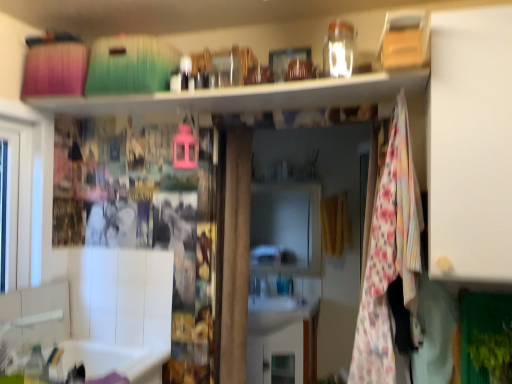
Find the location of a particular element. floral fabric blanket at center-right is located at coordinates (389, 256).

This screenshot has height=384, width=512. Describe the element at coordinates (470, 145) in the screenshot. I see `white matte cabinet at right` at that location.

Locate an element on the screen. The width and height of the screenshot is (512, 384). floral fabric blanket at center-right is located at coordinates (389, 256).

Is the surface of white matte cabinet at right in direct contact with white glossy cabinet at center?

They are not placed beside each other.

Does white matte cabinet at right have a lesser height compared to white glossy cabinet at center?

Incorrect, the height of white matte cabinet at right does not fall short of that of white glossy cabinet at center.

Consider the image. Is the depth of white matte cabinet at right greater than that of white glossy cabinet at center?

No, the depth of white matte cabinet at right is less than that of white glossy cabinet at center.

Is white matte cabinet at right positioned with its back to white glossy cabinet at center?

That's not correct — white matte cabinet at right is not looking away from white glossy cabinet at center.

Locate an element on the screen. The image size is (512, 384). cabinetry below the floral fabric blanket at center-right (from the image's perspective) is located at coordinates (282, 342).

Which is closer, (298, 344) or (383, 379)?

The point (383, 379) is more forward.

From a real-world perspective, between white matte cabinet at right and floral fabric blanket at center-right, who is vertically higher?

From a 3D spatial view, white matte cabinet at right is above.

Which object is wider, white matte cabinet at right or floral fabric blanket at center-right?

white matte cabinet at right.

Between point (472, 178) and point (412, 309), which one is positioned behind?

The point (412, 309) is more distant.

At what (x,y) coordinates should I click in order to perform the action: click on cabinet to the right of floral fabric blanket at center-right. Please return your answer as a coordinate pair (x, y). This screenshot has height=384, width=512. Looking at the image, I should click on (470, 145).

Would you say white glossy cabinet at center is part of floral fabric blanket at center-right's contents?

Actually, white glossy cabinet at center is outside floral fabric blanket at center-right.

Can you confirm if floral fabric blanket at center-right is thinner than white glossy cabinet at center?

No, floral fabric blanket at center-right is not thinner than white glossy cabinet at center.

Which object is positioned more to the left, floral fabric blanket at center-right or white glossy cabinet at center?

From the viewer's perspective, white glossy cabinet at center appears more on the left side.

From a real-world perspective, is floral fabric blanket at center-right below white glossy cabinet at center?

No, from a real-world perspective, floral fabric blanket at center-right is not beneath white glossy cabinet at center.

Does point (273, 325) appear closer or farther from the camera than point (440, 186)?

Clearly, point (273, 325) is more distant from the camera than point (440, 186).

Is white glossy cabinet at center next to white matte cabinet at right?

white glossy cabinet at center and white matte cabinet at right are not in contact.

In the scene shown: Looking at the image, does white glossy cabinet at center seem bigger or smaller compared to white matte cabinet at right?

Considering their sizes, white glossy cabinet at center takes up less space than white matte cabinet at right.

From the image's perspective, is floral fabric blanket at center-right under white matte cabinet at right?

Indeed, from the image's perspective, floral fabric blanket at center-right is shown beneath white matte cabinet at right.

Can you confirm if floral fabric blanket at center-right is thinner than white matte cabinet at right?

Yes.

Could white matte cabinet at right be considered to be inside floral fabric blanket at center-right?

No, floral fabric blanket at center-right does not contain white matte cabinet at right.

Does floral fabric blanket at center-right come behind white matte cabinet at right?

Yes, it is.

This screenshot has width=512, height=384. Identify the location of cabinet above the white glossy cabinet at center (from a real-world perspective). (470, 145).

This screenshot has width=512, height=384. Find the location of `cabinetry behind the floral fabric blanket at center-right`. cabinetry behind the floral fabric blanket at center-right is located at coordinates (282, 342).

From the image, which object appears to be farther from white glossy cabinet at center, white matte cabinet at right or floral fabric blanket at center-right?

Among the two, white matte cabinet at right is located further to white glossy cabinet at center.

When comparing their distances from white glossy cabinet at center, does floral fabric blanket at center-right or white matte cabinet at right seem closer?

Based on the image, floral fabric blanket at center-right appears to be nearer to white glossy cabinet at center.

When comparing their distances from floral fabric blanket at center-right, does white matte cabinet at right or white glossy cabinet at center seem further?

Based on the image, white glossy cabinet at center appears to be further to floral fabric blanket at center-right.

Which object lies further to the anchor point floral fabric blanket at center-right, white glossy cabinet at center or white matte cabinet at right?

Among the two, white glossy cabinet at center is located further to floral fabric blanket at center-right.

Which object lies further to the anchor point white matte cabinet at right, white glossy cabinet at center or floral fabric blanket at center-right?

white glossy cabinet at center is further to white matte cabinet at right.

Estimate the real-world distances between objects in this image. Which object is further from white matte cabinet at right, floral fabric blanket at center-right or white glossy cabinet at center?

white glossy cabinet at center is further to white matte cabinet at right.

You are a GUI agent. You are given a task and a screenshot of the screen. Output one action in this format:
    pyautogui.click(x=<x>, y=<y>)
    Task: Click on the blanket between white matte cabinet at right and white glossy cabinet at center along the z-axis
    The width and height of the screenshot is (512, 384).
    Given the screenshot: What is the action you would take?
    pyautogui.click(x=389, y=256)